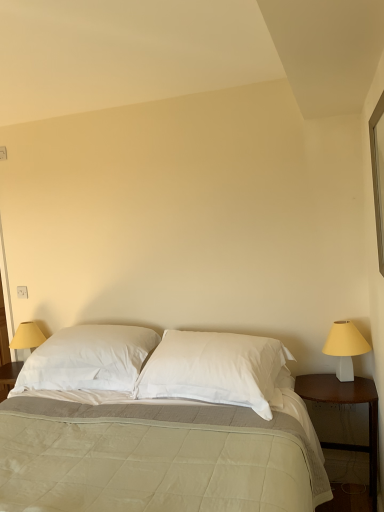
Question: Based on their positions, is white soft pillow at center, which is the first pillow in left-to-right order, located to the left or right of white quilted fabric bed at center?

Choices:
 (A) left
 (B) right

Answer: (A)

Question: Is white soft pillow at center, which is the first pillow in left-to-right order, wider or thinner than white quilted fabric bed at center?

Choices:
 (A) wide
 (B) thin

Answer: (B)

Question: Which object is the farthest from the white matte lampshade at right?

Choices:
 (A) clear glass window at upper right
 (B) white soft pillow at center, which is the first pillow in left-to-right order
 (C) white quilted fabric bed at center
 (D) wooden nightstand at right
 (E) white soft pillow at center, which appears as the 1th pillow when viewed from the right

Answer: (B)

Question: Estimate the real-world distances between objects in this image. Which object is farther from the white quilted fabric bed at center?

Choices:
 (A) clear glass window at upper right
 (B) white soft pillow at center, which is the first pillow in left-to-right order
 (C) white matte lampshade at right
 (D) white soft pillow at center, which is the second pillow in left-to-right order
 (E) wooden nightstand at right

Answer: (A)